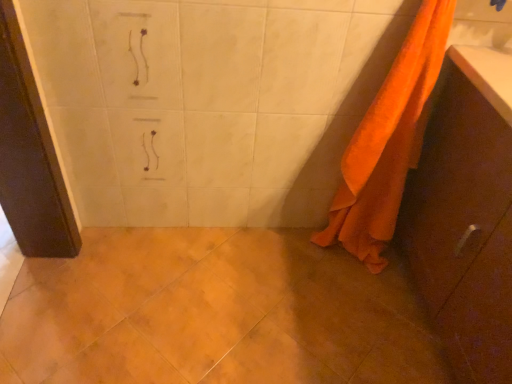
The image size is (512, 384). What do you see at coordinates (388, 142) in the screenshot?
I see `orange fabric towel at right` at bounding box center [388, 142].

Locate an element on the screen. orange fabric towel at right is located at coordinates coord(388,142).

In order to face orange fabric towel at right, should I rotate leftwards or rightwards?

It's best to rotate right around 16.965 degrees.

What do you see at coordinates (466, 216) in the screenshot?
I see `orange fabric cabinet at right` at bounding box center [466, 216].

Identify the location of orange fabric cabinet at right. The height and width of the screenshot is (384, 512). (466, 216).

Where is `orange fabric towel at right`? orange fabric towel at right is located at coordinates (388, 142).

Considering the positions of objects orange fabric towel at right and orange fabric cabinet at right in the image provided, who is more to the left, orange fabric towel at right or orange fabric cabinet at right?

orange fabric towel at right is more to the left.

Which object is further away from the camera taking this photo, orange fabric towel at right or orange fabric cabinet at right?

orange fabric towel at right.

Considering the points (397, 156) and (443, 256), which point is behind, point (397, 156) or point (443, 256)?

The point (397, 156) is behind.

From the image's perspective, is orange fabric towel at right beneath orange fabric cabinet at right?

Actually, orange fabric towel at right appears above orange fabric cabinet at right in the image.

From the picture: From a real-world perspective, who is located higher, orange fabric towel at right or orange fabric cabinet at right?

orange fabric towel at right, from a real-world perspective.

Based on the photo, looking at their sizes, would you say orange fabric towel at right is wider or thinner than orange fabric cabinet at right?

Considering their sizes, orange fabric towel at right looks slimmer than orange fabric cabinet at right.

Who is taller, orange fabric towel at right or orange fabric cabinet at right?

Standing taller between the two is orange fabric towel at right.

Consider the image. Does orange fabric towel at right have a larger size compared to orange fabric cabinet at right?

No.

Is orange fabric cabinet at right a part of orange fabric towel at right?

That's incorrect, orange fabric cabinet at right is not inside orange fabric towel at right.

Is orange fabric towel at right not close to orange fabric cabinet at right?

orange fabric towel at right is near orange fabric cabinet at right, not far away.

Is orange fabric towel at right facing towards orange fabric cabinet at right?

No, orange fabric towel at right is not aimed at orange fabric cabinet at right.

How different are the orientations of orange fabric towel at right and orange fabric cabinet at right in degrees?

The facing directions of orange fabric towel at right and orange fabric cabinet at right are 89.5 degrees apart.

Where is `bathroom cabinet that is in front of the orange fabric towel at right`? This screenshot has height=384, width=512. bathroom cabinet that is in front of the orange fabric towel at right is located at coordinates (466, 216).

Which is more to the right, orange fabric cabinet at right or orange fabric towel at right?

Positioned to the right is orange fabric cabinet at right.

Which is behind, orange fabric cabinet at right or orange fabric towel at right?

orange fabric towel at right is more distant.

Does point (494, 134) come behind point (415, 111)?

No, (494, 134) is in front of (415, 111).

From the image's perspective, does orange fabric cabinet at right appear higher than orange fabric towel at right?

No.

From a real-world perspective, is orange fabric cabinet at right on orange fabric towel at right?

Incorrect, from a real-world perspective, orange fabric cabinet at right is lower than orange fabric towel at right.

Which of these two, orange fabric cabinet at right or orange fabric towel at right, is wider?

Wider between the two is orange fabric cabinet at right.

Considering the sizes of objects orange fabric cabinet at right and orange fabric towel at right in the image provided, who is shorter, orange fabric cabinet at right or orange fabric towel at right?

orange fabric cabinet at right is shorter.

Looking at the image, does orange fabric cabinet at right seem bigger or smaller compared to orange fabric towel at right?

orange fabric cabinet at right is bigger than orange fabric towel at right.

Would you say orange fabric cabinet at right contains orange fabric towel at right?

Actually, orange fabric towel at right is outside orange fabric cabinet at right.

Is orange fabric cabinet at right in contact with orange fabric towel at right?

No, orange fabric cabinet at right is not beside orange fabric towel at right.

Is orange fabric cabinet at right positioned with its back to orange fabric towel at right?

No, orange fabric towel at right is not at the back of orange fabric cabinet at right.

How many degrees apart are the facing directions of orange fabric cabinet at right and orange fabric towel at right?

There is a 89.5-degree angle between the facing directions of orange fabric cabinet at right and orange fabric towel at right.

The height and width of the screenshot is (384, 512). Find the location of `bathroom cabinet below the orange fabric towel at right (from the image's perspective)`. bathroom cabinet below the orange fabric towel at right (from the image's perspective) is located at coordinates (466, 216).

You are a GUI agent. You are given a task and a screenshot of the screen. Output one action in this format:
    pyautogui.click(x=<x>, y=<y>)
    Task: Click on the towel located on the left of orange fabric cabinet at right
    
    Given the screenshot: What is the action you would take?
    pyautogui.click(x=388, y=142)

This screenshot has width=512, height=384. Identify the location of towel that is behind the orange fabric cabinet at right. (388, 142).